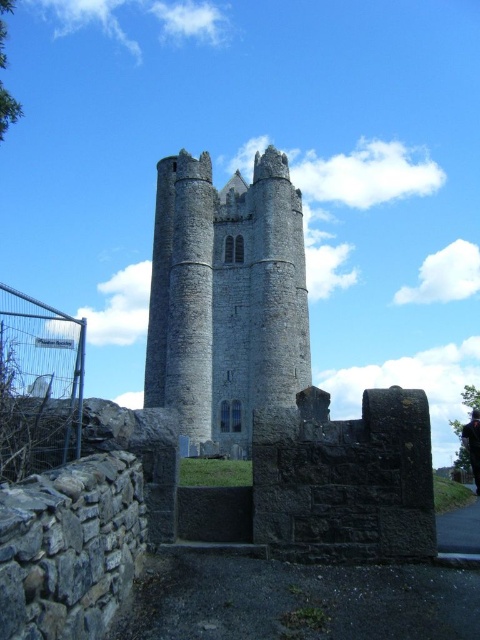
Can you confirm if gray stone tower at center is thinner than metal wire fence at lower left?

No.

Can you confirm if gray stone tower at center is bigger than metal wire fence at lower left?

Yes.

Between point (266, 220) and point (36, 433), which one is positioned behind?

Point (266, 220)

This screenshot has width=480, height=640. I want to click on gray stone tower at center, so pos(226,296).